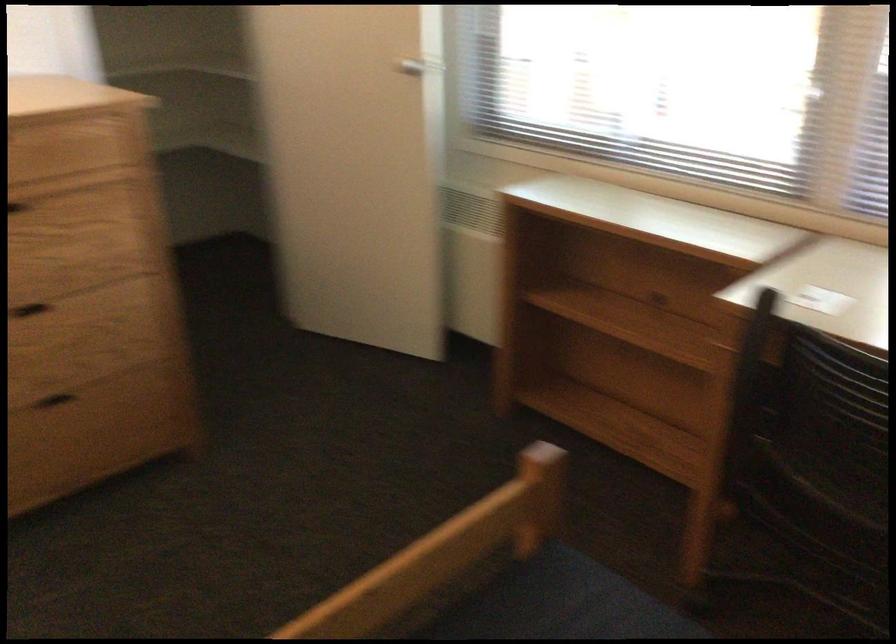
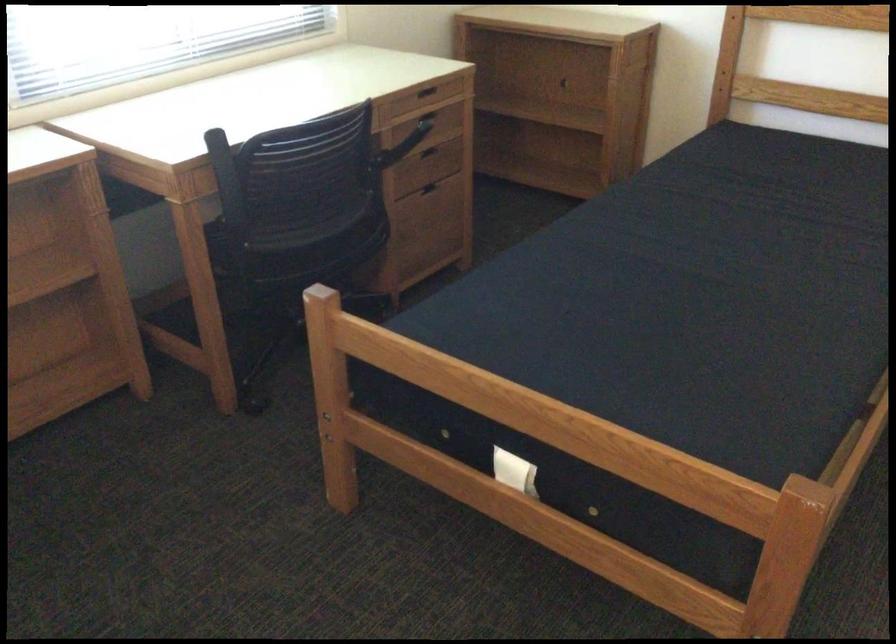
Locate, in the second image, the point that corresponds to the point at 746,368 in the first image.

(227, 182)